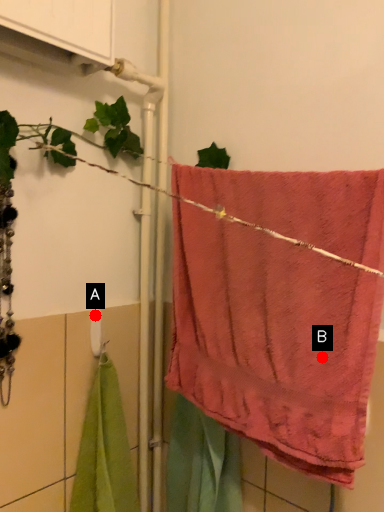
Question: Two points are circled on the image, labeled by A and B beside each circle. Which point is farther to the camera?

Choices:
 (A) A is further
 (B) B is further

Answer: (A)